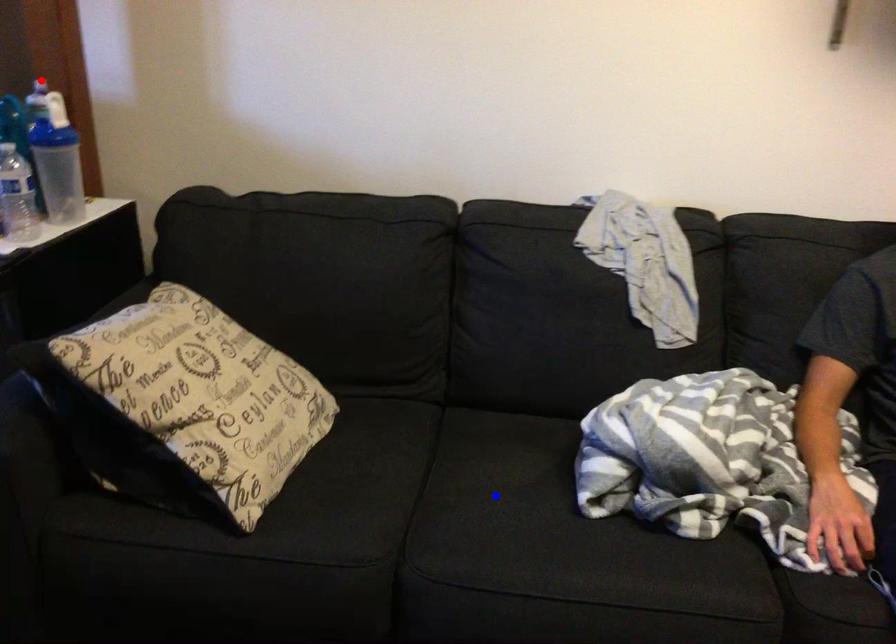
Question: Two points are marked on the image. Which point is closer to the camera?

Choices:
 (A) Blue point is closer.
 (B) Red point is closer.

Answer: (A)